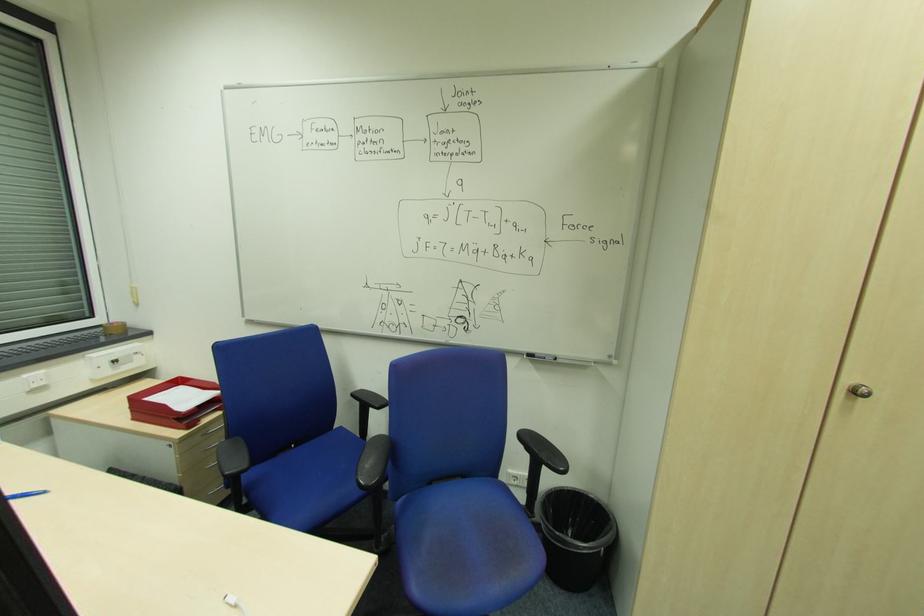
This screenshot has height=616, width=924. I want to click on black trash can, so click(x=574, y=536).